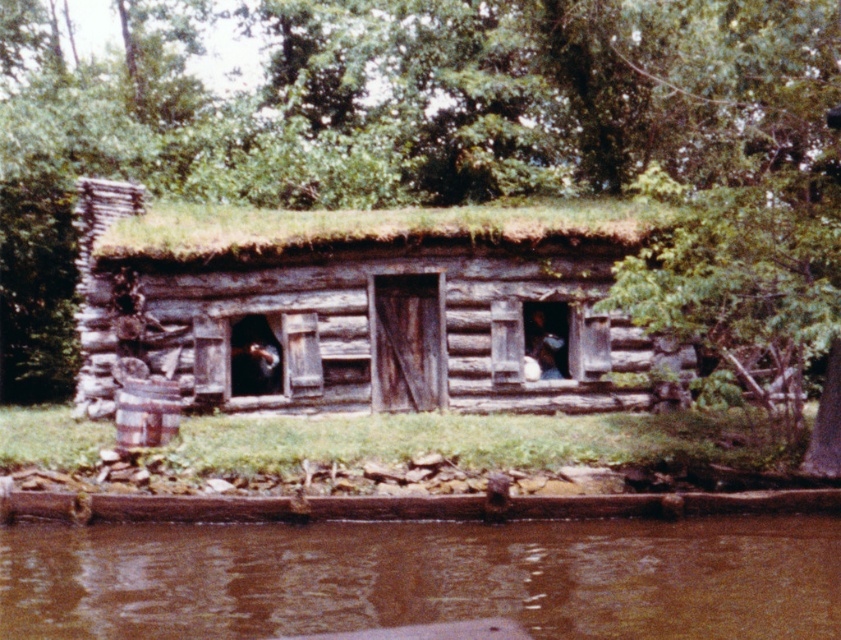
Describe the element at coordinates (459, 141) in the screenshot. Image resolution: width=841 pixels, height=640 pixels. I see `green leafy tree at center` at that location.

Is point (816, 177) positioned behind point (648, 424)?

No, it is not.

What do you see at coordinates (459, 141) in the screenshot?
I see `green leafy tree at center` at bounding box center [459, 141].

Identify the location of green leafy tree at center. The height and width of the screenshot is (640, 841). point(459,141).

Who is lower down, green grass at lower center or green moss at center?

green grass at lower center

Based on the photo, is green grass at lower center closer to the viewer compared to green moss at center?

Yes, green grass at lower center is in front of green moss at center.

The width and height of the screenshot is (841, 640). What are the coordinates of `green grass at lower center` in the screenshot? It's located at (485, 440).

Looking at this image, does brown muddy water at lower center have a larger size compared to green moss at center?

Incorrect, brown muddy water at lower center is not larger than green moss at center.

Who is shorter, brown muddy water at lower center or green moss at center?

brown muddy water at lower center

Is point (643, 572) behind point (504, 211)?

No, (643, 572) is in front of (504, 211).

Identify the location of brown muddy water at lower center. [424, 577].